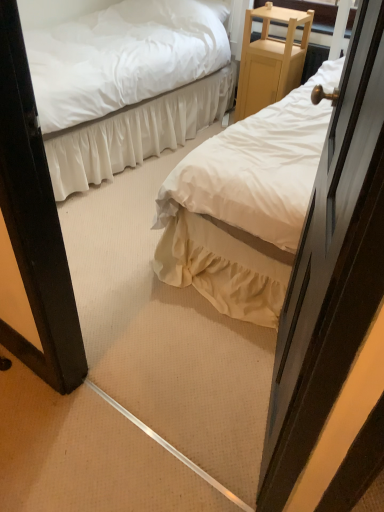
Where is `white satin bed at center, arranged as the 2th bed when viewed from the right`? Image resolution: width=384 pixels, height=512 pixels. white satin bed at center, arranged as the 2th bed when viewed from the right is located at coordinates (133, 105).

What do you see at coordinates (133, 105) in the screenshot? The image size is (384, 512). I see `white satin bed at center, arranged as the 1th bed when viewed from the left` at bounding box center [133, 105].

In order to face white cotton bed at center, which is the 2th bed in left-to-right order, should I rotate leftwards or rightwards?

A 15.905 degree turn to the right will do.

Find the location of a particular element. The width and height of the screenshot is (384, 512). light wood/finely crafted nightstand at upper right is located at coordinates (270, 59).

Find the location of a particular element. white satin bed at center, arranged as the 1th bed when viewed from the left is located at coordinates (133, 105).

Is white cotton bed at center, which ranks as the 1th bed in right-to-left order, in contact with white satin bed at center, arranged as the 1th bed when viewed from the left?

No, white cotton bed at center, which ranks as the 1th bed in right-to-left order, is not next to white satin bed at center, arranged as the 1th bed when viewed from the left.

Can you confirm if white cotton bed at center, which ranks as the 1th bed in right-to-left order, is shorter than white satin bed at center, arranged as the 1th bed when viewed from the left?

In fact, white cotton bed at center, which ranks as the 1th bed in right-to-left order, may be taller than white satin bed at center, arranged as the 1th bed when viewed from the left.

Which of these two, white cotton bed at center, which ranks as the 1th bed in right-to-left order, or white satin bed at center, arranged as the 1th bed when viewed from the left, is wider?

white cotton bed at center, which ranks as the 1th bed in right-to-left order.

From a real-world perspective, which is physically below, white cotton bed at center, which ranks as the 1th bed in right-to-left order, or white satin bed at center, arranged as the 2th bed when viewed from the right?

white satin bed at center, arranged as the 2th bed when viewed from the right.

I want to click on furniture lying above the white cotton bed at center, which ranks as the 1th bed in right-to-left order (from the image's perspective), so click(x=270, y=59).

Based on the photo, is white cotton bed at center, which is the 2th bed in left-to-right order, not inside light wood/finely crafted nightstand at upper right?

Yes, white cotton bed at center, which is the 2th bed in left-to-right order, is not within light wood/finely crafted nightstand at upper right.

Measure the distance from white cotton bed at center, which ranks as the 1th bed in right-to-left order, to light wood/finely crafted nightstand at upper right.

white cotton bed at center, which ranks as the 1th bed in right-to-left order, and light wood/finely crafted nightstand at upper right are 1.06 meters apart.

Is point (302, 213) positioned in front of point (287, 34)?

Yes, point (302, 213) is in front of point (287, 34).

Is light wood/finely crafted nightstand at upper right aimed at wooden door at right?

No, light wood/finely crafted nightstand at upper right is not facing towards wooden door at right.

Which of these two, light wood/finely crafted nightstand at upper right or wooden door at right, is bigger?

wooden door at right.

Is light wood/finely crafted nightstand at upper right taller than wooden door at right?

Incorrect, the height of light wood/finely crafted nightstand at upper right is not larger of that of wooden door at right.

Identify the location of furniture on the right side of wooden door at right. This screenshot has height=512, width=384. (270, 59).

Looking at this image, which of these two, white satin bed at center, arranged as the 2th bed when viewed from the right, or white cotton bed at center, which ranks as the 1th bed in right-to-left order, is smaller?

Smaller between the two is white cotton bed at center, which ranks as the 1th bed in right-to-left order.

Which object is positioned more to the left, white satin bed at center, arranged as the 1th bed when viewed from the left, or white cotton bed at center, which ranks as the 1th bed in right-to-left order?

white satin bed at center, arranged as the 1th bed when viewed from the left.

From the image's perspective, which one is positioned higher, white satin bed at center, arranged as the 1th bed when viewed from the left, or white cotton bed at center, which is the 2th bed in left-to-right order?

From the image's view, white satin bed at center, arranged as the 1th bed when viewed from the left, is above.

How distant is white satin bed at center, arranged as the 1th bed when viewed from the left, from white cotton bed at center, which ranks as the 1th bed in right-to-left order?

white satin bed at center, arranged as the 1th bed when viewed from the left, and white cotton bed at center, which ranks as the 1th bed in right-to-left order, are 3.38 feet apart from each other.

Identify the location of door located in front of the white satin bed at center, arranged as the 2th bed when viewed from the right. pyautogui.click(x=331, y=267).

Based on the photo, does white satin bed at center, arranged as the 2th bed when viewed from the right, touch wooden door at right?

No.

Does white satin bed at center, arranged as the 1th bed when viewed from the left, turn towards wooden door at right?

Yes, white satin bed at center, arranged as the 1th bed when viewed from the left, is facing wooden door at right.

From a real-world perspective, which object stands above the other?

wooden door at right, from a real-world perspective.

Is wooden door at right next to white cotton bed at center, which ranks as the 1th bed in right-to-left order?

No.

Can you tell me how much wooden door at right and white cotton bed at center, which is the 2th bed in left-to-right order, differ in facing direction?

The angular difference between wooden door at right and white cotton bed at center, which is the 2th bed in left-to-right order, is 67.8 degrees.

Is wooden door at right to the left of white cotton bed at center, which ranks as the 1th bed in right-to-left order, from the viewer's perspective?

Correct, you'll find wooden door at right to the left of white cotton bed at center, which ranks as the 1th bed in right-to-left order.

Is wooden door at right inside the boundaries of light wood/finely crafted nightstand at upper right, or outside?

wooden door at right cannot be found inside light wood/finely crafted nightstand at upper right.

This screenshot has width=384, height=512. What are the coordinates of `furniture behind the wooden door at right` in the screenshot? It's located at (270, 59).

Which object is further away from the camera, wooden door at right or light wood/finely crafted nightstand at upper right?

Positioned behind is light wood/finely crafted nightstand at upper right.

Based on the photo, which of these two, wooden door at right or light wood/finely crafted nightstand at upper right, is thinner?

wooden door at right is thinner.

The height and width of the screenshot is (512, 384). What are the coordinates of `bed above the white cotton bed at center, which is the 2th bed in left-to-right order (from the image's perspective)` in the screenshot? It's located at (133, 105).

Starting from the light wood/finely crafted nightstand at upper right, which bed is the 2nd one in front? Please provide its 2D coordinates.

[(244, 203)]

Estimate the real-world distances between objects in this image. Which object is closer to light wood/finely crafted nightstand at upper right, wooden door at right or white satin bed at center, arranged as the 1th bed when viewed from the left?

The object closer to light wood/finely crafted nightstand at upper right is white satin bed at center, arranged as the 1th bed when viewed from the left.

Looking at the image, which one is located closer to wooden door at right, white satin bed at center, arranged as the 2th bed when viewed from the right, or light wood/finely crafted nightstand at upper right?

white satin bed at center, arranged as the 2th bed when viewed from the right.

Estimate the real-world distances between objects in this image. Which object is closer to white cotton bed at center, which is the 2th bed in left-to-right order, light wood/finely crafted nightstand at upper right or wooden door at right?

Based on the image, wooden door at right appears to be nearer to white cotton bed at center, which is the 2th bed in left-to-right order.

Considering their positions, is light wood/finely crafted nightstand at upper right positioned closer to white cotton bed at center, which ranks as the 1th bed in right-to-left order, than white satin bed at center, arranged as the 2th bed when viewed from the right?

Based on the image, white satin bed at center, arranged as the 2th bed when viewed from the right, appears to be nearer to white cotton bed at center, which ranks as the 1th bed in right-to-left order.

Which object lies nearer to the anchor point light wood/finely crafted nightstand at upper right, white cotton bed at center, which is the 2th bed in left-to-right order, or wooden door at right?

white cotton bed at center, which is the 2th bed in left-to-right order, is positioned closer to the anchor light wood/finely crafted nightstand at upper right.

Considering their positions, is light wood/finely crafted nightstand at upper right positioned further to wooden door at right than white cotton bed at center, which ranks as the 1th bed in right-to-left order?

Among the two, light wood/finely crafted nightstand at upper right is located further to wooden door at right.

Which object lies nearer to the anchor point light wood/finely crafted nightstand at upper right, wooden door at right or white cotton bed at center, which is the 2th bed in left-to-right order?

Based on the image, white cotton bed at center, which is the 2th bed in left-to-right order, appears to be nearer to light wood/finely crafted nightstand at upper right.

From the image, which object appears to be nearer to white satin bed at center, arranged as the 2th bed when viewed from the right, wooden door at right or light wood/finely crafted nightstand at upper right?

Based on the image, light wood/finely crafted nightstand at upper right appears to be nearer to white satin bed at center, arranged as the 2th bed when viewed from the right.

Image resolution: width=384 pixels, height=512 pixels. In order to click on bed between white satin bed at center, arranged as the 1th bed when viewed from the left, and wooden door at right in the up-down direction in this screenshot , I will do coord(244,203).

This screenshot has width=384, height=512. I want to click on bed between white cotton bed at center, which is the 2th bed in left-to-right order, and light wood/finely crafted nightstand at upper right in the front-back direction, so click(x=133, y=105).